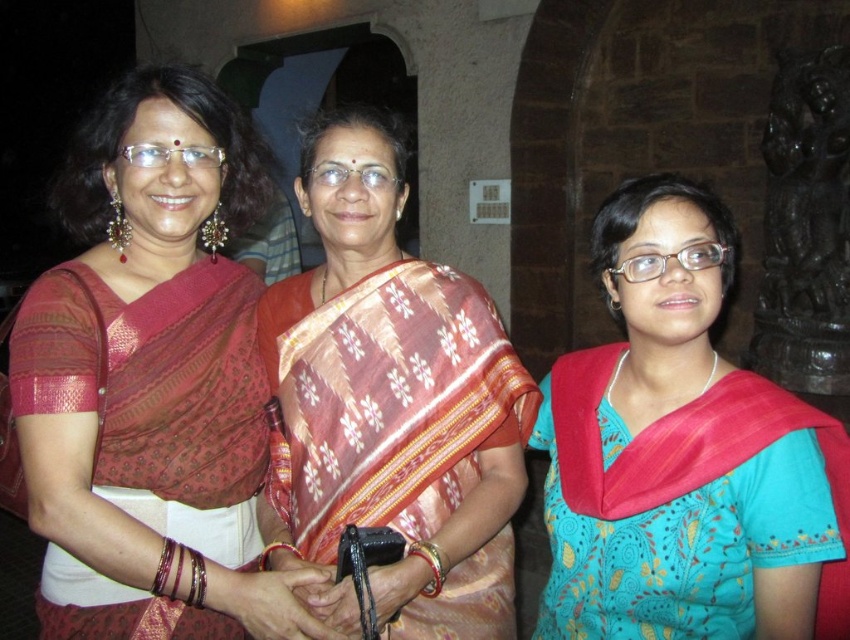
You are a photographer setting up for a group photo. You need to ensure that the matte silk saree at center and the teal silk blouse at center are both visible in the frame. Given their widths, which item requires a wider shot to fully capture its details?

The matte silk saree at center requires a wider shot because its width surpasses that of the teal silk blouse at center.

You are a photographer setting up a shoot in a traditional Indian setting. You need to ensure that the matte silk saree at center and the teal silk blouse at center are visible in the frame. Based on their sizes, which one will appear larger in the photo?

The matte silk saree at center is taller than the teal silk blouse at center, so it will appear larger in the photo.